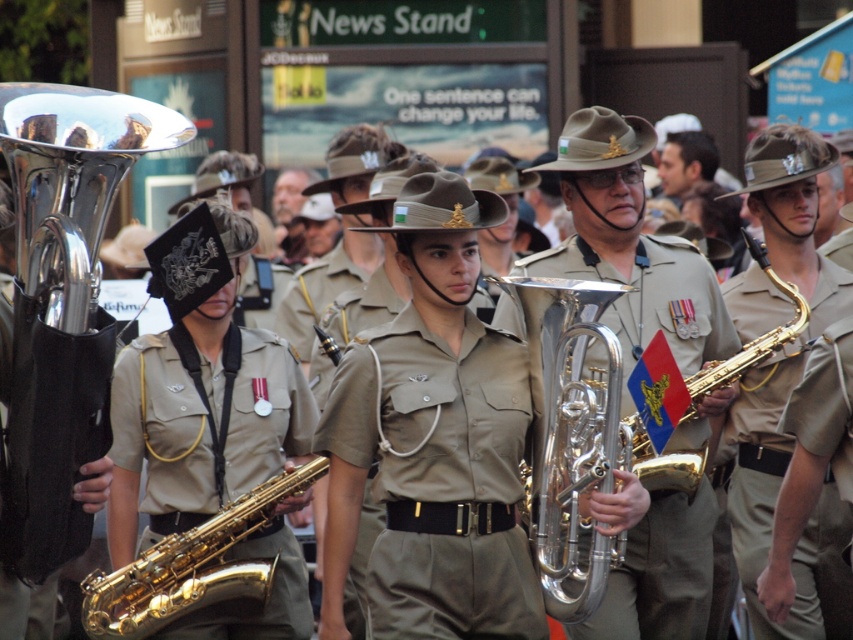
Question: Can you confirm if metallic brass tuba at center is positioned above khaki fabric uniform at center?

Choices:
 (A) no
 (B) yes

Answer: (A)

Question: Which of the following is the farthest from the observer?

Choices:
 (A) (462, 516)
 (B) (772, 449)

Answer: (B)

Question: Which object is the closest to the olive green fabric uniform at center?

Choices:
 (A) metallic brass tuba at center
 (B) khaki fabric uniform at center
 (C) gold shiny saxophone at center

Answer: (C)

Question: Can you confirm if olive green fabric uniform at center is wider than gold shiny saxophone at center?

Choices:
 (A) no
 (B) yes

Answer: (A)

Question: Does olive green fabric uniform at center have a greater width compared to gold shiny saxophone at center?

Choices:
 (A) no
 (B) yes

Answer: (A)

Question: Which object appears farthest from the camera in this image?

Choices:
 (A) metallic brass tuba at center
 (B) khaki fabric uniform at center
 (C) gold shiny saxophone at center

Answer: (B)